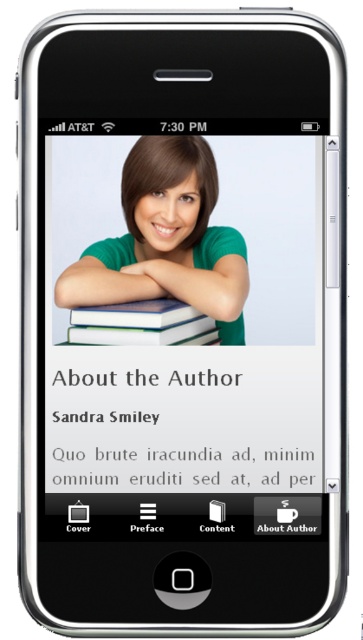
Question: Observing the image, what is the correct spatial positioning of black paper text at center in reference to green matte shirt at center?

Choices:
 (A) right
 (B) left

Answer: (A)

Question: Which object is farther from the camera taking this photo?

Choices:
 (A) black paper text at center
 (B) green matte shirt at center

Answer: (B)

Question: Is black paper text at center to the left of green matte shirt at center from the viewer's perspective?

Choices:
 (A) yes
 (B) no

Answer: (B)

Question: Which point is closer to the camera?

Choices:
 (A) black paper text at center
 (B) green matte shirt at center

Answer: (A)

Question: Which object appears farthest from the camera in this image?

Choices:
 (A) black paper text at center
 (B) green matte shirt at center

Answer: (B)

Question: Considering the relative positions of black paper text at center and green matte shirt at center in the image provided, where is black paper text at center located with respect to green matte shirt at center?

Choices:
 (A) right
 (B) left

Answer: (A)